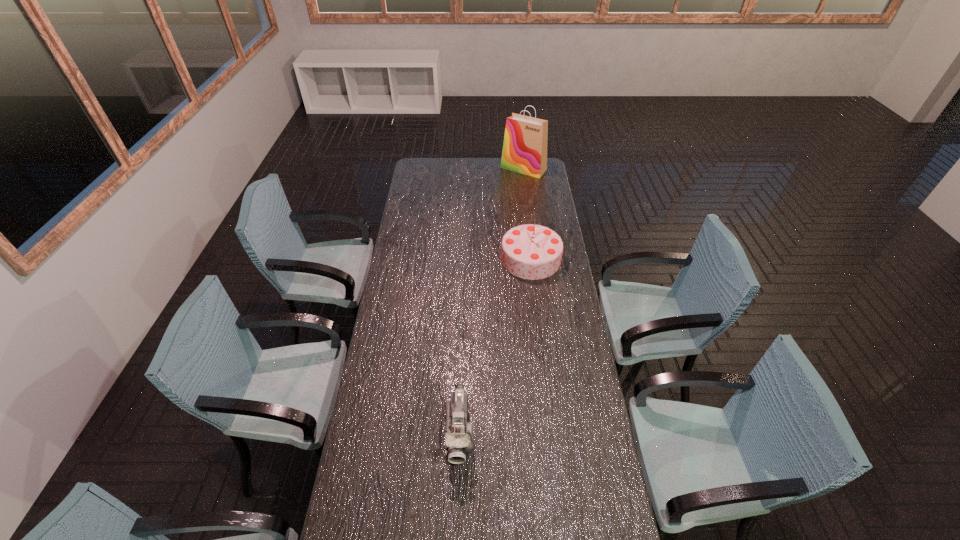
Find the location of a particular element. The width and height of the screenshot is (960, 540). the tallest object is located at coordinates (524, 151).

Identify the location of the farthest object. (524, 151).

At what (x,y) coordinates should I click in order to perform the action: click on the second farthest object. Please return your answer as a coordinate pair (x, y). Looking at the image, I should click on (529, 251).

Identify the location of the second tallest object. (529, 251).

Locate an element on the screen. Image resolution: width=960 pixels, height=540 pixels. the leftmost object is located at coordinates (459, 436).

The image size is (960, 540). What are the coordinates of `the shortest object` in the screenshot? It's located at (459, 436).

Find the location of a particular element. The height and width of the screenshot is (540, 960). vacant space situated on the front of the shopping bag is located at coordinates (527, 198).

Locate an element on the screen. vacant region located 0.400m on the left of the second nearest object is located at coordinates (420, 259).

I want to click on free space located on the front-facing side of the leftmost object, so click(458, 508).

Where is `object that is at the far edge`? Image resolution: width=960 pixels, height=540 pixels. object that is at the far edge is located at coordinates (524, 151).